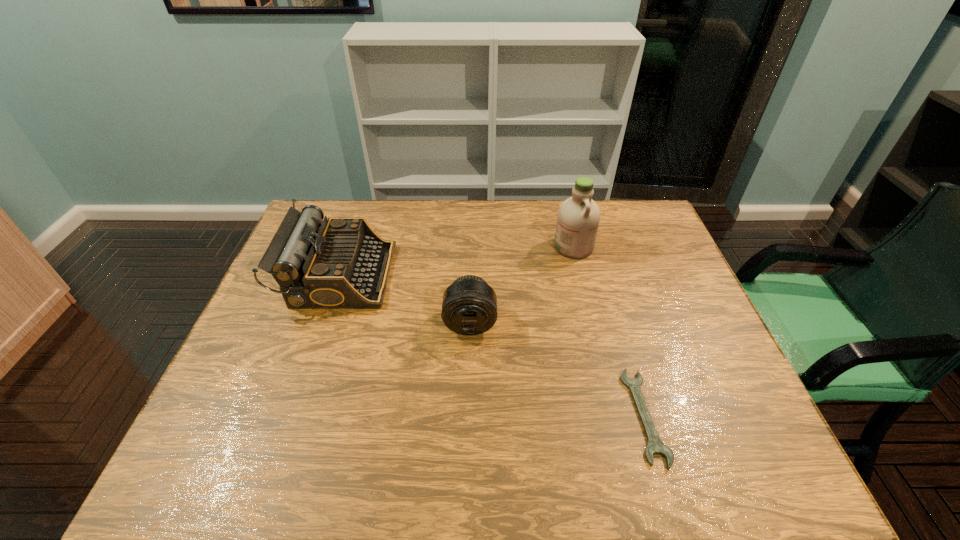
The image size is (960, 540). Identify the location of vacant space at the right edge of the desktop. (x=687, y=286).

The height and width of the screenshot is (540, 960). In the image, there is a desktop. Find the location of `vacant space at the near left corner`. vacant space at the near left corner is located at coordinates (175, 481).

At what (x,y) coordinates should I click in order to perform the action: click on vacant region between the wrench and the tallest object. Please return your answer as a coordinate pair (x, y). This screenshot has height=540, width=960. Looking at the image, I should click on (609, 332).

Where is `blank region between the wrench and the cleansing agent`? The width and height of the screenshot is (960, 540). blank region between the wrench and the cleansing agent is located at coordinates (609, 332).

The height and width of the screenshot is (540, 960). Identify the location of free point between the cleansing agent and the nearest object. (609, 332).

Locate an element on the screen. This screenshot has height=540, width=960. vacant space that's between the tallest object and the wrench is located at coordinates (609, 332).

This screenshot has height=540, width=960. I want to click on free spot between the shortest object and the tallest object, so click(609, 332).

Locate an element on the screen. This screenshot has width=960, height=540. blank region between the second tallest object and the shortest object is located at coordinates (492, 346).

Identify the location of blank region between the telephoto lens and the wrench. (558, 369).

Identify the location of free spot between the typewriter and the second object from left to right. (405, 299).